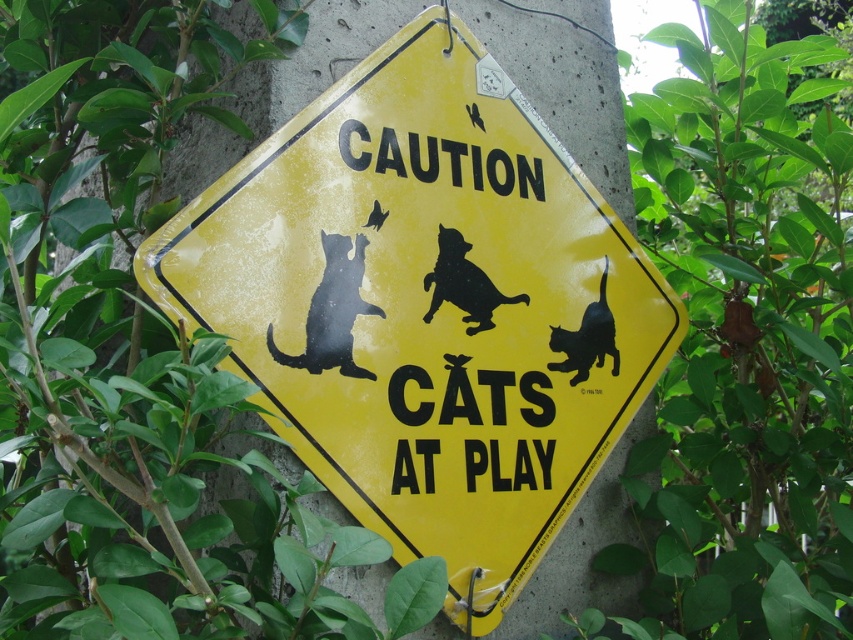
You are a delivery person trying to avoid hitting any cats with your cart. You see the yellow plastic sign at center and the black matte cat at upper center. Which object is larger and might be easier to spot from a distance?

The yellow plastic sign at center is bigger than the black matte cat at upper center, so the yellow plastic sign at center would be easier to spot from a distance.

You are a delivery person approaching a garden path. You see a yellow plastic sign at center and a black matte cat at upper center. Which object is higher up in the image?

The yellow plastic sign at center is located above the black matte cat at upper center, so the yellow plastic sign at center is higher up in the image.